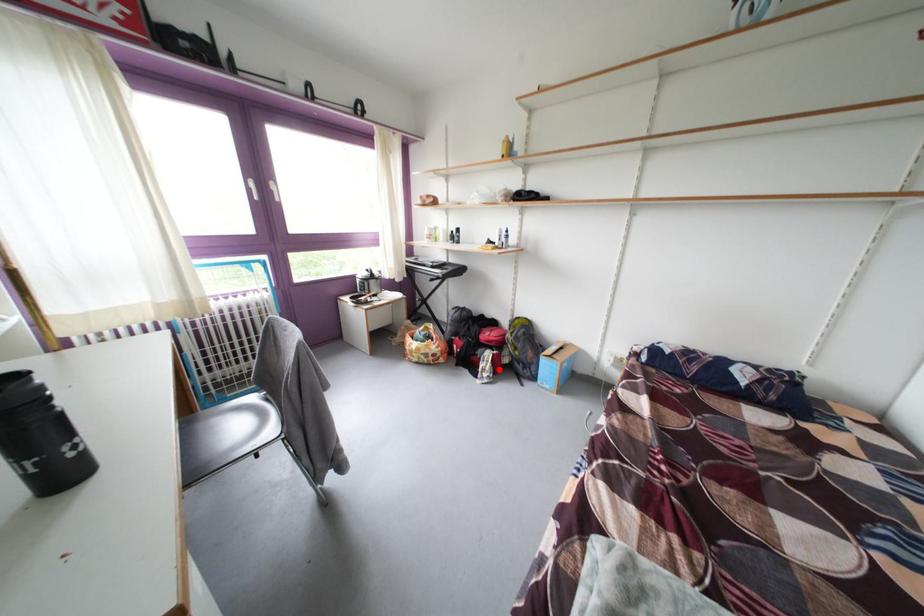
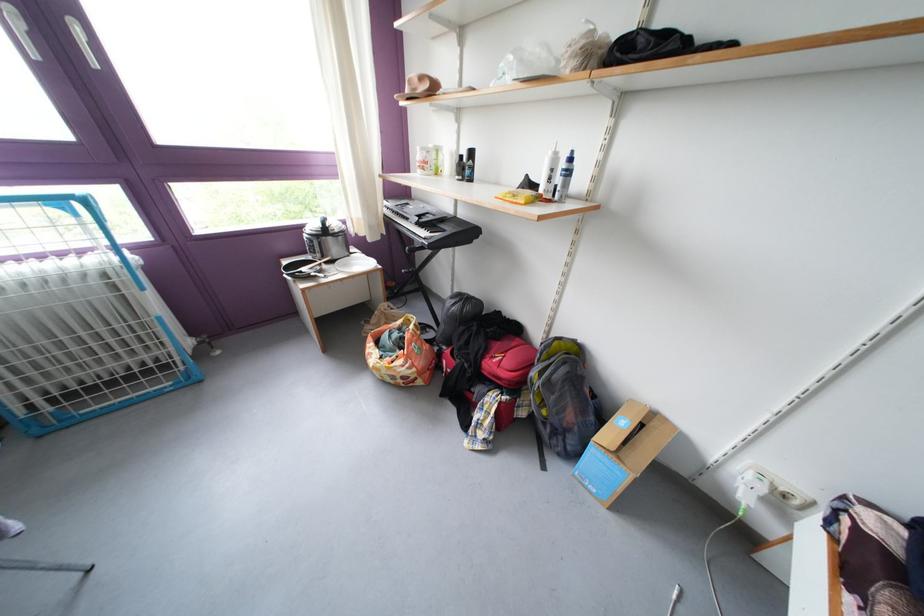
The point at the highlighted location is marked in the first image. Where is the corresponding point in the second image?

(500, 426)